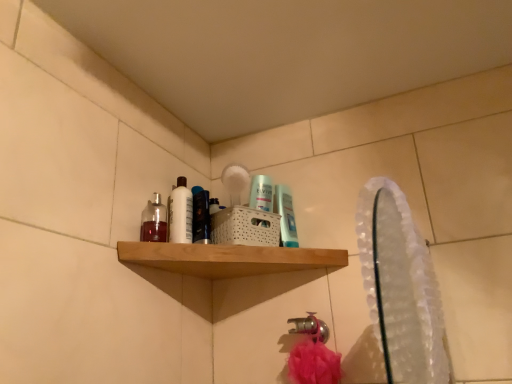
You are a GUI agent. You are given a task and a screenshot of the screen. Output one action in this format:
    pyautogui.click(x=<x>, y=<y>)
    Task: Click on the clear plastic mirror at upper right
    This screenshot has width=512, height=384.
    Given the screenshot: What is the action you would take?
    pyautogui.click(x=400, y=286)

Measure the distance between point (281, 217) and camera.

A distance of 4.08 feet exists between point (281, 217) and camera.

This screenshot has width=512, height=384. I want to click on translucent plastic mouthwash at upper center, which ranks as the 3th mouthwash in left-to-right order, so click(286, 216).

In the scene shown: What is the approximate width of white glossy bottle at upper left?

It is 1.72 inches.

Locate an element on the screen. translucent glass bottle at upper left, which is the third mouthwash in right-to-left order is located at coordinates (154, 221).

What do you see at coordinates (154, 221) in the screenshot? I see `translucent glass bottle at upper left, which ranks as the 1th mouthwash in left-to-right order` at bounding box center [154, 221].

The height and width of the screenshot is (384, 512). I want to click on wooden shelf at upper center, so click(227, 258).

The image size is (512, 384). Find the location of `clear plastic mirror at upper right`. clear plastic mirror at upper right is located at coordinates (400, 286).

Considering the relative sizes of wooden shelf at upper center and clear plastic mirror at upper right in the image provided, is wooden shelf at upper center thinner than clear plastic mirror at upper right?

Incorrect, the width of wooden shelf at upper center is not less than that of clear plastic mirror at upper right.

Considering the relative positions of wooden shelf at upper center and clear plastic mirror at upper right in the image provided, is wooden shelf at upper center to the left or to the right of clear plastic mirror at upper right?

Clearly, wooden shelf at upper center is on the left of clear plastic mirror at upper right in the image.

Is clear plastic mirror at upper right completely or partially inside wooden shelf at upper center?

No, wooden shelf at upper center does not contain clear plastic mirror at upper right.

Is white glossy bottle at upper left to the left or to the right of wooden shelf at upper center in the image?

white glossy bottle at upper left is positioned on wooden shelf at upper center's left side.

From a real-world perspective, is white glossy bottle at upper left physically below wooden shelf at upper center?

No, from a real-world perspective, white glossy bottle at upper left is not under wooden shelf at upper center.

Is wooden shelf at upper center inside white glossy bottle at upper left?

No, wooden shelf at upper center is not inside white glossy bottle at upper left.

Is point (179, 224) farther from viewer compared to point (277, 263)?

Yes.

Relative to translucent plastic mouthwash at upper center, acting as the first mouthwash starting from the right, is translucent plastic mouthwash at center, the 2th mouthwash positioned from the right, in front or behind?

translucent plastic mouthwash at center, the 2th mouthwash positioned from the right, is in front of translucent plastic mouthwash at upper center, acting as the first mouthwash starting from the right.

From the picture: Is translucent plastic mouthwash at center, the 2th mouthwash positioned from the right, to the left of translucent plastic mouthwash at upper center, which ranks as the 3th mouthwash in left-to-right order, from the viewer's perspective?

Indeed, translucent plastic mouthwash at center, the 2th mouthwash positioned from the right, is positioned on the left side of translucent plastic mouthwash at upper center, which ranks as the 3th mouthwash in left-to-right order.

From a real-world perspective, is translucent plastic mouthwash at center, which ranks as the 2th mouthwash in left-to-right order, beneath translucent plastic mouthwash at upper center, which ranks as the 3th mouthwash in left-to-right order?

No, from a real-world perspective, translucent plastic mouthwash at center, which ranks as the 2th mouthwash in left-to-right order, is not below translucent plastic mouthwash at upper center, which ranks as the 3th mouthwash in left-to-right order.

From a real-world perspective, which object stands above the other?

From a 3D spatial view, translucent plastic mouthwash at upper center, acting as the first mouthwash starting from the right, is above.

Looking at this image, between translucent plastic mouthwash at upper center, which ranks as the 3th mouthwash in left-to-right order, and clear plastic mirror at upper right, which one has smaller width?

translucent plastic mouthwash at upper center, which ranks as the 3th mouthwash in left-to-right order, is thinner.

From a real-world perspective, is translucent glass bottle at upper left, which is the third mouthwash in right-to-left order, positioned over wooden shelf at upper center based on gravity?

Indeed, from a real-world perspective, translucent glass bottle at upper left, which is the third mouthwash in right-to-left order, stands above wooden shelf at upper center.

Between translucent glass bottle at upper left, which ranks as the 1th mouthwash in left-to-right order, and wooden shelf at upper center, which one has smaller width?

Thinner between the two is translucent glass bottle at upper left, which ranks as the 1th mouthwash in left-to-right order.

Is translucent glass bottle at upper left, which ranks as the 1th mouthwash in left-to-right order, positioned before wooden shelf at upper center?

No, translucent glass bottle at upper left, which ranks as the 1th mouthwash in left-to-right order, is behind wooden shelf at upper center.

Looking at this image, could you measure the distance between wooden shelf at upper center and translucent plastic mouthwash at center, which ranks as the 2th mouthwash in left-to-right order?

6.10 inches.

Is wooden shelf at upper center positioned with its back to translucent plastic mouthwash at center, which ranks as the 2th mouthwash in left-to-right order?

No.

Would you say wooden shelf at upper center is a long distance from translucent plastic mouthwash at center, the 2th mouthwash positioned from the right?

No, there isn't a large distance between wooden shelf at upper center and translucent plastic mouthwash at center, the 2th mouthwash positioned from the right.

Looking at this image, from a real-world perspective, is wooden shelf at upper center positioned under translucent plastic mouthwash at center, the 2th mouthwash positioned from the right, based on gravity?

Correct, in the physical world, wooden shelf at upper center is lower than translucent plastic mouthwash at center, the 2th mouthwash positioned from the right.

Considering the sizes of objects clear plastic mirror at upper right and translucent plastic mouthwash at upper center, acting as the first mouthwash starting from the right, in the image provided, who is thinner, clear plastic mirror at upper right or translucent plastic mouthwash at upper center, acting as the first mouthwash starting from the right,?

translucent plastic mouthwash at upper center, acting as the first mouthwash starting from the right.

From a real-world perspective, is clear plastic mirror at upper right physically located above or below translucent plastic mouthwash at upper center, acting as the first mouthwash starting from the right?

In terms of real-world spatial position, clear plastic mirror at upper right is below translucent plastic mouthwash at upper center, acting as the first mouthwash starting from the right.

Is clear plastic mirror at upper right oriented away from translucent plastic mouthwash at upper center, which ranks as the 3th mouthwash in left-to-right order?

No, clear plastic mirror at upper right's orientation is not away from translucent plastic mouthwash at upper center, which ranks as the 3th mouthwash in left-to-right order.

What are the coordinates of `shelf lying behind the clear plastic mirror at upper right` in the screenshot? It's located at (227, 258).

Find the location of a particular element. The image size is (512, 384). shelf in front of the white glossy bottle at upper left is located at coordinates (227, 258).

Looking at the image, which one is located closer to wooden shelf at upper center, translucent plastic mouthwash at upper center, acting as the first mouthwash starting from the right, or white glossy bottle at upper left?

white glossy bottle at upper left lies closer to wooden shelf at upper center than the other object.

Estimate the real-world distances between objects in this image. Which object is closer to translucent glass bottle at upper left, which ranks as the 1th mouthwash in left-to-right order, white glossy bottle at upper left or wooden shelf at upper center?

The object closer to translucent glass bottle at upper left, which ranks as the 1th mouthwash in left-to-right order, is white glossy bottle at upper left.

From the image, which object appears to be farther from white glossy bottle at upper left, translucent plastic mouthwash at center, the 2th mouthwash positioned from the right, or clear plastic mirror at upper right?

clear plastic mirror at upper right is further to white glossy bottle at upper left.

When comparing their distances from translucent plastic mouthwash at center, which ranks as the 2th mouthwash in left-to-right order, does white glossy bottle at upper left or clear plastic mirror at upper right seem further?

The object further to translucent plastic mouthwash at center, which ranks as the 2th mouthwash in left-to-right order, is clear plastic mirror at upper right.

Estimate the real-world distances between objects in this image. Which object is closer to translucent plastic mouthwash at center, which ranks as the 2th mouthwash in left-to-right order, wooden shelf at upper center or white glossy bottle at upper left?

white glossy bottle at upper left is closer to translucent plastic mouthwash at center, which ranks as the 2th mouthwash in left-to-right order.

Looking at the image, which one is located closer to wooden shelf at upper center, translucent glass bottle at upper left, which is the third mouthwash in right-to-left order, or white glossy bottle at upper left?

white glossy bottle at upper left is closer to wooden shelf at upper center.

Which object lies nearer to the anchor point translucent plastic mouthwash at upper center, which ranks as the 3th mouthwash in left-to-right order, white glossy bottle at upper left or wooden shelf at upper center?

The object closer to translucent plastic mouthwash at upper center, which ranks as the 3th mouthwash in left-to-right order, is wooden shelf at upper center.

From the picture: Estimate the real-world distances between objects in this image. Which object is closer to wooden shelf at upper center, clear plastic mirror at upper right or white glossy bottle at upper left?

white glossy bottle at upper left is closer to wooden shelf at upper center.

You are a GUI agent. You are given a task and a screenshot of the screen. Output one action in this format:
    pyautogui.click(x=<x>, y=<y>)
    Task: Click on the mouthwash positioned between wooden shelf at upper center and translucent plastic mouthwash at center, which ranks as the 2th mouthwash in left-to-right order, from near to far
    
    Given the screenshot: What is the action you would take?
    pyautogui.click(x=154, y=221)

The height and width of the screenshot is (384, 512). What are the coordinates of `shelf positioned between clear plastic mirror at upper right and white glossy bottle at upper left from near to far` in the screenshot? It's located at (227, 258).

The image size is (512, 384). I want to click on mouthwash between translucent glass bottle at upper left, which is the third mouthwash in right-to-left order, and translucent plastic mouthwash at upper center, which ranks as the 3th mouthwash in left-to-right order, from left to right, so click(x=201, y=216).

Identify the location of cleaning product between translucent glass bottle at upper left, which ranks as the 1th mouthwash in left-to-right order, and translucent plastic mouthwash at center, the 2th mouthwash positioned from the right, in the horizontal direction. (180, 213).